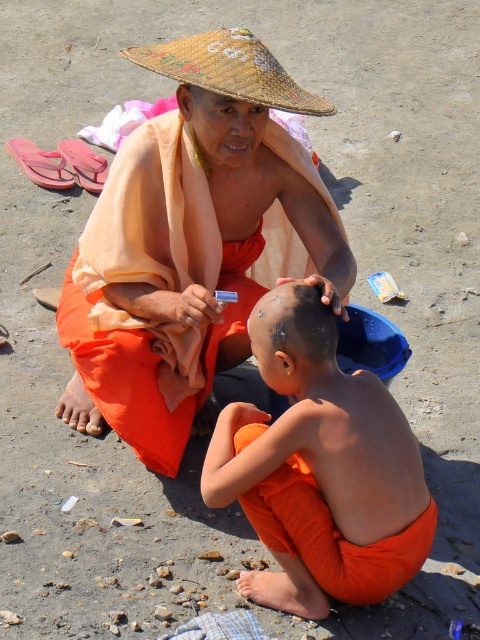
Between orange matte cloth at lower center and woven straw hat at upper center, which one has more height?

orange matte cloth at lower center is taller.

Is orange matte cloth at lower center bigger than woven straw hat at upper center?

Yes, orange matte cloth at lower center is bigger than woven straw hat at upper center.

Which is in front, point (315, 531) or point (264, 99)?

Point (315, 531) is in front.

Locate an element on the screen. This screenshot has width=480, height=640. orange matte cloth at lower center is located at coordinates (320, 468).

Is point (142, 332) behind point (414, 458)?

That is True.

Is orange cloth monk at center shorter than orange matte cloth at lower center?

Incorrect, orange cloth monk at center's height does not fall short of orange matte cloth at lower center's.

Locate an element on the screen. orange cloth monk at center is located at coordinates (193, 243).

The width and height of the screenshot is (480, 640). Find the location of `orange cloth monk at center`. orange cloth monk at center is located at coordinates (193, 243).

Is orange cloth monk at center above black matte hair at center?

Yes.

Is point (184, 355) positioned in front of point (328, 323)?

No.

Where is `orange cloth monk at center`? orange cloth monk at center is located at coordinates (193, 243).